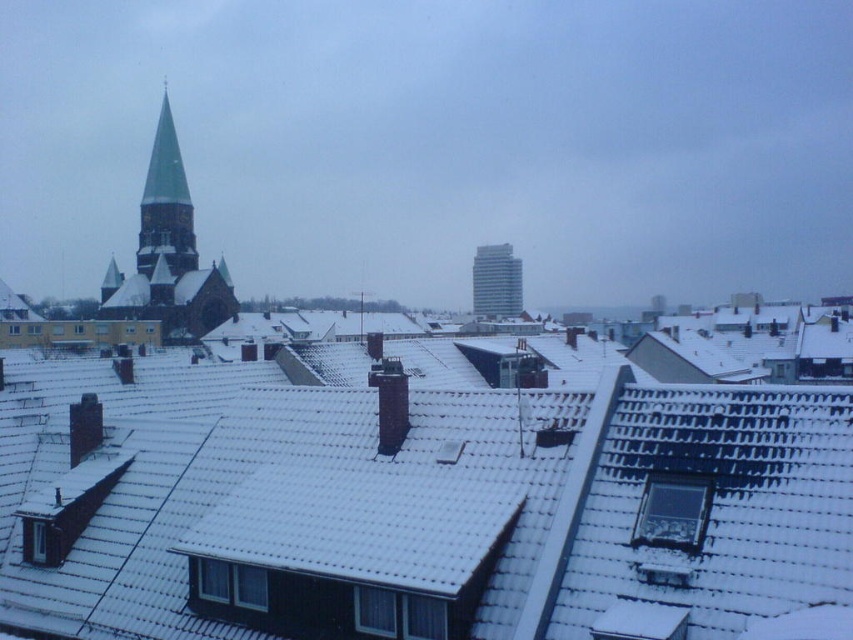
Is green matte tower at upper left further to camera compared to white glassy tower at center?

No, green matte tower at upper left is closer to the viewer.

Is green matte tower at upper left thinner than white glassy tower at center?

In fact, green matte tower at upper left might be wider than white glassy tower at center.

Who is more distant from viewer, (144,314) or (502,308)?

The point (502,308) is behind.

Find the location of `green matte tower at upper left`. green matte tower at upper left is located at coordinates (167, 253).

Can you confirm if green matte tower at upper left is smaller than smooth gray chimney at center?

Incorrect, green matte tower at upper left is not smaller in size than smooth gray chimney at center.

Which of these two, green matte tower at upper left or smooth gray chimney at center, stands taller?

green matte tower at upper left

Does point (186, 285) come farther from viewer compared to point (387, 410)?

Yes.

Where is `green matte tower at upper left`? Image resolution: width=853 pixels, height=640 pixels. green matte tower at upper left is located at coordinates (167, 253).

Is green glass spire at upper left closer to camera compared to smooth gray chimney at center?

No, it is not.

Can you confirm if green glass spire at upper left is taller than smooth gray chimney at center?

Correct, green glass spire at upper left is much taller as smooth gray chimney at center.

Locate an element on the screen. The width and height of the screenshot is (853, 640). green glass spire at upper left is located at coordinates (165, 204).